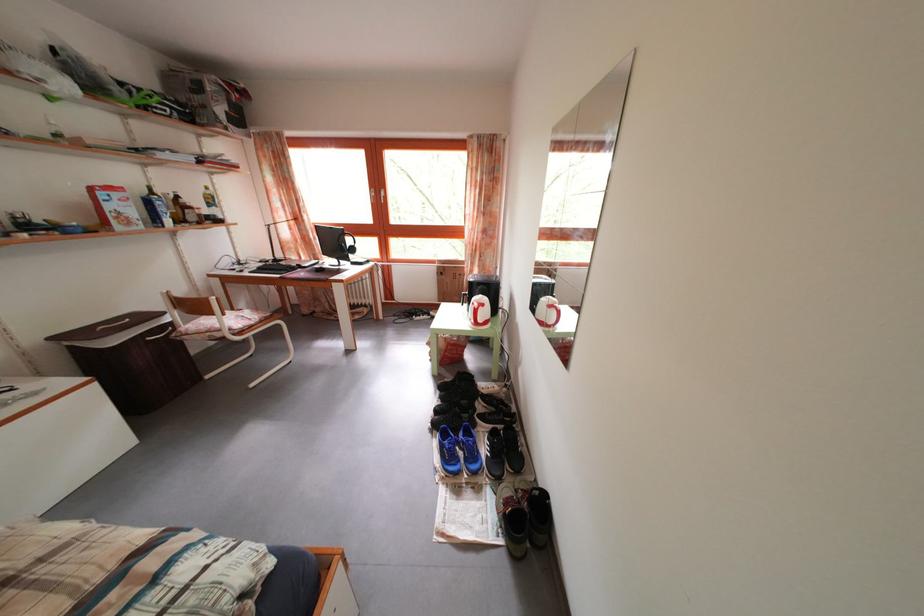
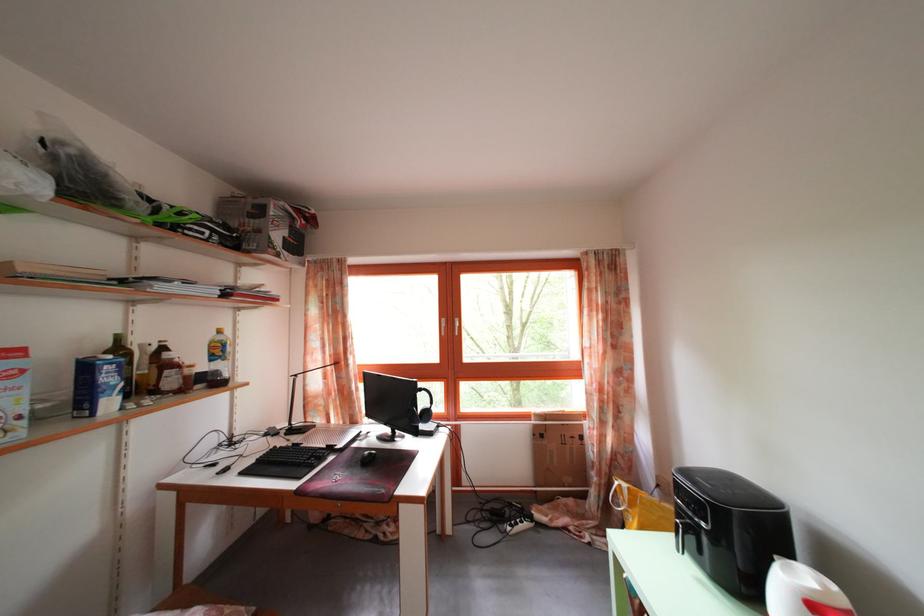
The point at (x=288, y=277) is marked in the first image. Where is the corresponding point in the second image?

(307, 472)